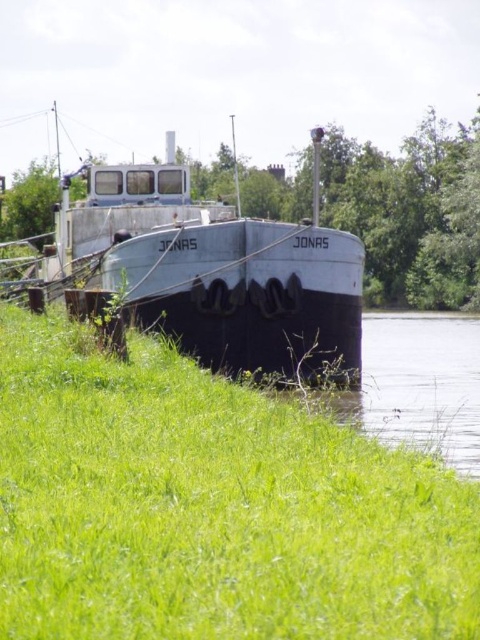
Question: Which of the following is the closest to the observer?

Choices:
 (A) (231, 282)
 (B) (9, 454)

Answer: (B)

Question: Is green grassy at lower left smaller than rusty metal barge at center?

Choices:
 (A) yes
 (B) no

Answer: (A)

Question: Which point is farther from the camera taking this photo?

Choices:
 (A) (177, 561)
 (B) (70, 308)

Answer: (B)

Question: Is green grassy at lower left bigger than rusty metal barge at center?

Choices:
 (A) no
 (B) yes

Answer: (A)

Question: Where is green grassy at lower left located in relation to rusty metal barge at center in the image?

Choices:
 (A) left
 (B) right

Answer: (B)